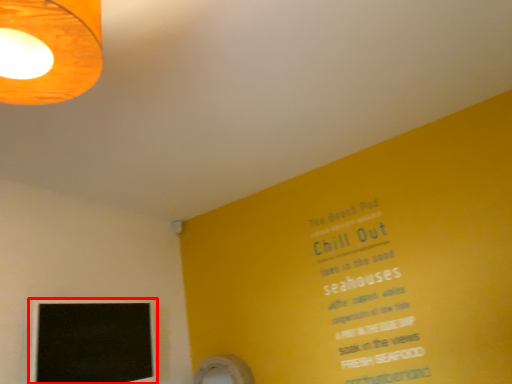
Question: From the image's perspective, what is the correct spatial relationship of computer monitor (annotated by the red box) in relation to lamp?

Choices:
 (A) below
 (B) above

Answer: (A)